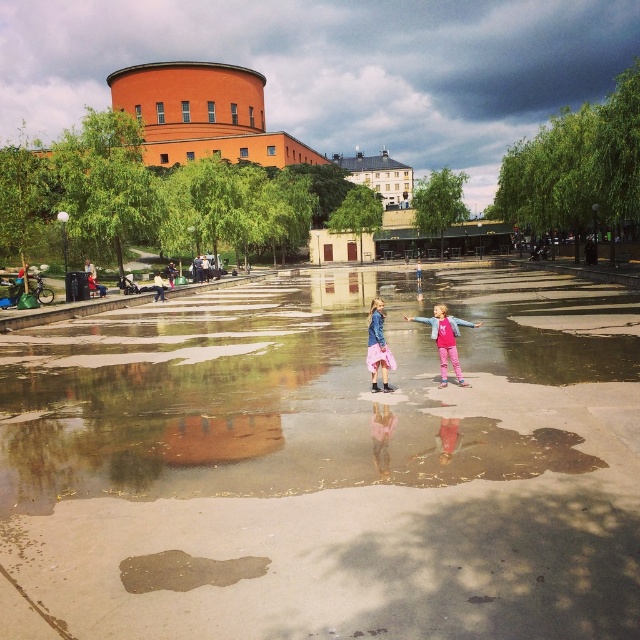
Who is higher up, pink fabric dress at center or pink satin skirt at center?

Positioned higher is pink fabric dress at center.

In the scene shown: Who is shorter, pink fabric dress at center or pink satin skirt at center?

pink fabric dress at center

Is point (440, 307) closer to camera compared to point (378, 314)?

No, (440, 307) is further to viewer.

Locate an element on the screen. This screenshot has width=640, height=640. pink fabric dress at center is located at coordinates (445, 339).

Does shiny concrete puddle at center appear over pink fabric dress at center?

No, shiny concrete puddle at center is not above pink fabric dress at center.

Is shiny concrete puddle at center taller than pink fabric dress at center?

Correct, shiny concrete puddle at center is much taller as pink fabric dress at center.

Who is more forward, (504, 349) or (444, 312)?

Positioned in front is point (444, 312).

At what (x,y) coordinates should I click in order to perform the action: click on shiny concrete puddle at center. Please return your answer as a coordinate pair (x, y). Image resolution: width=640 pixels, height=640 pixels. Looking at the image, I should click on (292, 392).

Is shiny concrete puddle at center closer to camera compared to pink satin skirt at center?

That is True.

Does shiny concrete puddle at center have a lesser width compared to pink satin skirt at center?

No.

This screenshot has height=640, width=640. Identify the location of shiny concrete puddle at center. click(x=292, y=392).

Locate an element on the screen. The image size is (640, 640). shiny concrete puddle at center is located at coordinates (292, 392).